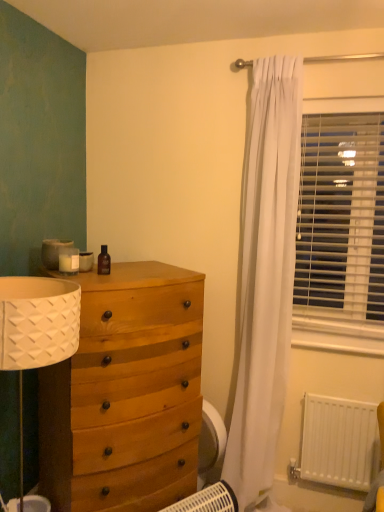
Measure the distance between point [224,493] and camera.

Point [224,493] is 5.93 feet away from camera.

Find the location of a particular element. wooden chest of drawers at left is located at coordinates (126, 394).

The image size is (384, 512). Find the location of `brown glass bottle at upper center`. brown glass bottle at upper center is located at coordinates (104, 261).

From the image's perspective, is white plastic heater at lower center over white plastic blinds at right?

Incorrect, from the image's perspective, white plastic heater at lower center is lower than white plastic blinds at right.

From a real-world perspective, is white plastic heater at lower center positioned above or below white plastic blinds at right?

From a real-world perspective, white plastic heater at lower center is physically below white plastic blinds at right.

Visually, is white plastic heater at lower center positioned to the left or to the right of white plastic blinds at right?

Based on their positions, white plastic heater at lower center is located to the left of white plastic blinds at right.

Is white plastic heater at lower center next to white plastic blinds at right?

No, white plastic heater at lower center is not touching white plastic blinds at right.

Measure the distance from wooden chest of drawers at left to white plastic heater at lower center.

The distance of wooden chest of drawers at left from white plastic heater at lower center is 17.84 inches.

Considering the points (121, 428) and (222, 511), which point is in front, point (121, 428) or point (222, 511)?

The point (121, 428) is more forward.

Which of these two, wooden chest of drawers at left or white plastic heater at lower center, is bigger?

With larger size is wooden chest of drawers at left.

Is wooden chest of drawers at left inside the boundaries of white plastic heater at lower center, or outside?

wooden chest of drawers at left lies outside white plastic heater at lower center.

Is white plastic blinds at right to the left of wooden chest of drawers at left from the viewer's perspective?

No, white plastic blinds at right is not to the left of wooden chest of drawers at left.

Does white plastic blinds at right lie behind wooden chest of drawers at left?

Yes.

Considering the positions of points (301, 298) and (157, 436), is point (301, 298) closer to camera compared to point (157, 436)?

No, it is behind (157, 436).

Which object is closer to the camera taking this photo, wooden chest of drawers at left or white plastic blinds at right?

wooden chest of drawers at left is in front.

From a real-world perspective, is wooden chest of drawers at left located beneath white plastic blinds at right?

Correct, in the physical world, wooden chest of drawers at left is lower than white plastic blinds at right.

From the image's perspective, does wooden chest of drawers at left appear higher than white plastic blinds at right?

No.

How different are the orientations of white matte radiator at lower right and wooden chest of drawers at left in degrees?

The facing directions of white matte radiator at lower right and wooden chest of drawers at left are 51.6 degrees apart.

Based on the photo, are white matte radiator at lower right and wooden chest of drawers at left beside each other?

No, white matte radiator at lower right is not with wooden chest of drawers at left.

Is white matte radiator at lower right inside or outside of wooden chest of drawers at left?

The correct answer is: outside.

Between white matte radiator at lower right and wooden chest of drawers at left, which one has smaller width?

white matte radiator at lower right.

Is wooden chest of drawers at left not near brown glass bottle at upper center?

That's not correct — wooden chest of drawers at left is a little close to brown glass bottle at upper center.

Which is further, (60, 449) or (109, 269)?

The point (109, 269) is behind.

From a real-world perspective, between wooden chest of drawers at left and brown glass bottle at upper center, who is vertically higher?

brown glass bottle at upper center is physically above.

Between wooden chest of drawers at left and brown glass bottle at upper center, which one has more height?

With more height is wooden chest of drawers at left.

Which object is positioned more to the right, white plastic heater at lower center or wooden chest of drawers at left?

Positioned to the right is white plastic heater at lower center.

Could wooden chest of drawers at left be considered to be inside white plastic heater at lower center?

No, wooden chest of drawers at left is located outside of white plastic heater at lower center.

Could you tell me if white plastic heater at lower center is facing wooden chest of drawers at left?

No, white plastic heater at lower center is not aimed at wooden chest of drawers at left.

Is point (211, 492) more distant than point (160, 342)?

Yes, it is behind point (160, 342).

You are a GUI agent. You are given a task and a screenshot of the screen. Output one action in this format:
    pyautogui.click(x=<x>, y=<y>)
    Task: Click on the heater on the left of white plastic blinds at right
    The height and width of the screenshot is (512, 384).
    Given the screenshot: What is the action you would take?
    pyautogui.click(x=208, y=500)

This screenshot has width=384, height=512. I want to click on heater beneath the wooden chest of drawers at left (from a real-world perspective), so click(x=208, y=500).

In the scene shown: Estimate the real-world distances between objects in this image. Which object is further from white matte radiator at lower right, wooden chest of drawers at left or brown glass bottle at upper center?

The object further to white matte radiator at lower right is brown glass bottle at upper center.

Which object lies further to the anchor point white plastic blinds at right, white matte radiator at lower right or wooden chest of drawers at left?

wooden chest of drawers at left lies further to white plastic blinds at right than the other object.

Which object lies nearer to the anchor point wooden chest of drawers at left, white plastic blinds at right or brown glass bottle at upper center?

brown glass bottle at upper center is closer to wooden chest of drawers at left.

Looking at this image, considering their positions, is wooden chest of drawers at left positioned closer to white plastic heater at lower center than white matte radiator at lower right?

wooden chest of drawers at left is closer to white plastic heater at lower center.

Estimate the real-world distances between objects in this image. Which object is further from white plastic heater at lower center, white plastic blinds at right or brown glass bottle at upper center?

white plastic blinds at right is positioned further to the anchor white plastic heater at lower center.

Looking at the image, which one is located further to brown glass bottle at upper center, white plastic heater at lower center or white plastic blinds at right?

The object further to brown glass bottle at upper center is white plastic blinds at right.

Estimate the real-world distances between objects in this image. Which object is closer to white matte radiator at lower right, wooden chest of drawers at left or white plastic blinds at right?

white plastic blinds at right is positioned closer to the anchor white matte radiator at lower right.

Looking at the image, which one is located further to white plastic blinds at right, brown glass bottle at upper center or white plastic heater at lower center?

Among the two, white plastic heater at lower center is located further to white plastic blinds at right.

Find the location of `radiator between white plastic blinds at right and white plastic heater at lower center in the up-down direction`. radiator between white plastic blinds at right and white plastic heater at lower center in the up-down direction is located at coordinates pos(339,442).

Identify the location of the chest of drawers situated between brown glass bottle at upper center and white matte radiator at lower right from left to right. This screenshot has width=384, height=512. (126, 394).

Where is `heater located between wooden chest of drawers at left and white matte radiator at lower right in the left-right direction`? heater located between wooden chest of drawers at left and white matte radiator at lower right in the left-right direction is located at coordinates (208, 500).

The width and height of the screenshot is (384, 512). I want to click on radiator between brown glass bottle at upper center and white plastic heater at lower center in the up-down direction, so click(339, 442).